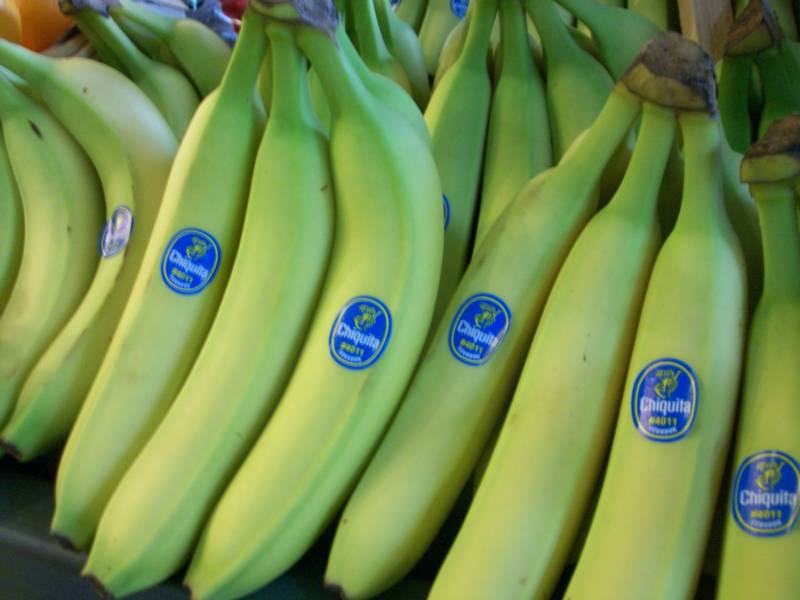
Locate an element on the screen. This screenshot has width=800, height=600. sticker is located at coordinates (120, 238), (181, 263), (352, 340), (446, 213), (482, 326), (669, 392), (746, 484), (454, 19).